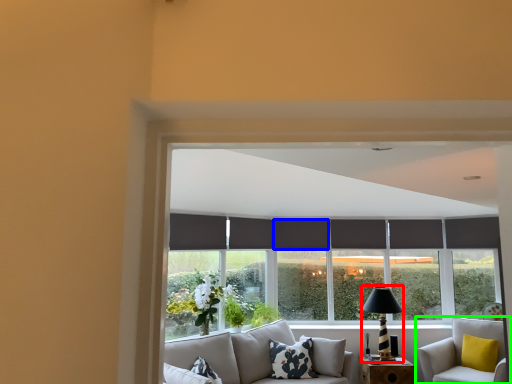
Question: Which object is the closest to the table lamp (highlighted by a red box)? Choose among these: curtain (highlighted by a blue box) or studio couch (highlighted by a green box).

Choices:
 (A) curtain
 (B) studio couch

Answer: (B)